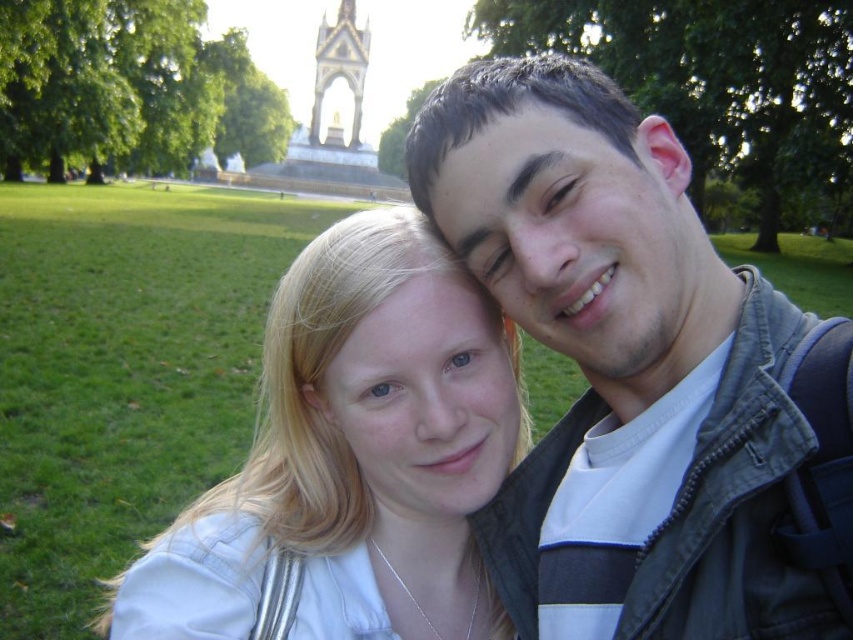
Question: Which point is farther to the camera?

Choices:
 (A) (697, 266)
 (B) (311, 259)
 (C) (317, 83)

Answer: (C)

Question: Which point is closer to the camera taking this photo?

Choices:
 (A) (383, 470)
 (B) (358, 74)
 (C) (514, 234)

Answer: (C)

Question: Which object is positioned farthest from the white fabric at center?

Choices:
 (A) bronze statue at upper center
 (B) dark green jacket at center

Answer: (A)

Question: From the image, what is the correct spatial relationship of white fabric at center in relation to bronze statue at upper center?

Choices:
 (A) right
 (B) left

Answer: (A)

Question: Is white fabric at center thinner than bronze statue at upper center?

Choices:
 (A) yes
 (B) no

Answer: (B)

Question: Can you confirm if dark green jacket at center is wider than white fabric at center?

Choices:
 (A) no
 (B) yes

Answer: (A)